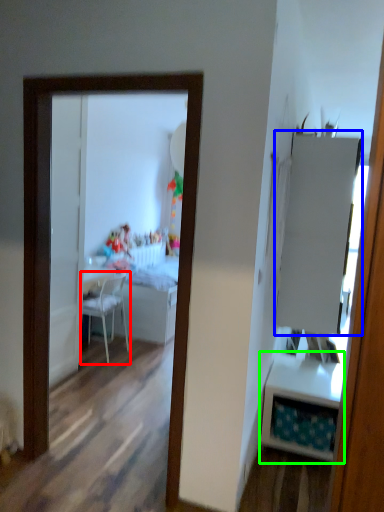
Question: Which object is positioned closest to chair (highlighted by a red box)? Select from armoire (highlighted by a blue box) and table (highlighted by a green box).

Choices:
 (A) armoire
 (B) table

Answer: (B)